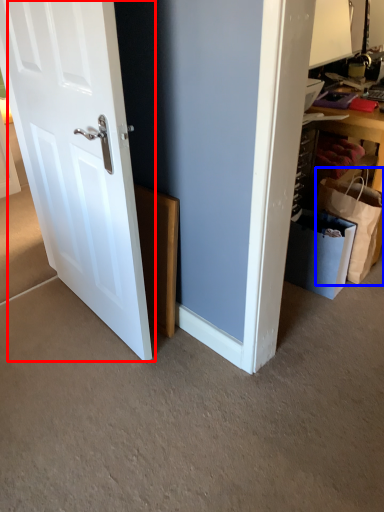
Question: Among these objects, which one is farthest to the camera, door (highlighted by a red box) or shopping bag (highlighted by a blue box)?

Choices:
 (A) door
 (B) shopping bag

Answer: (B)